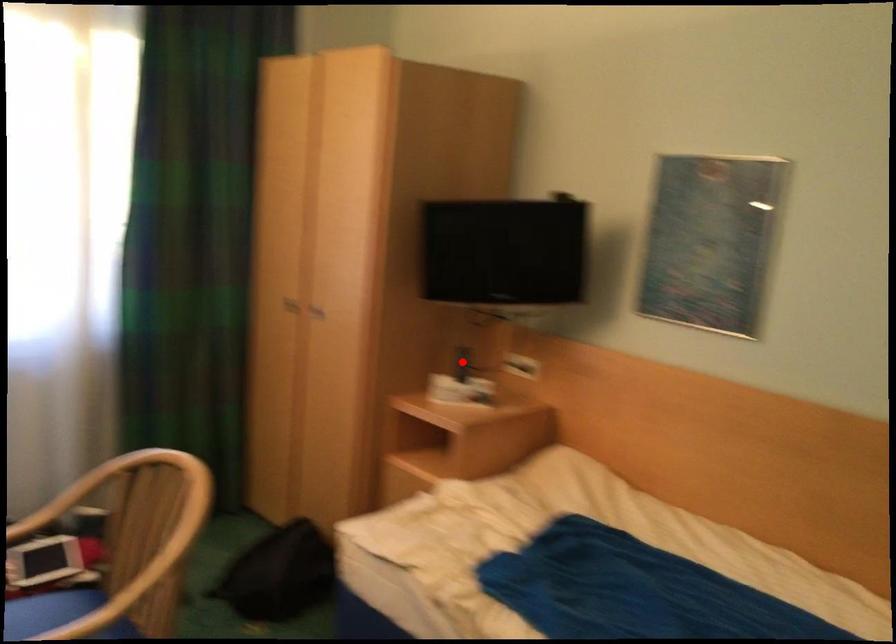
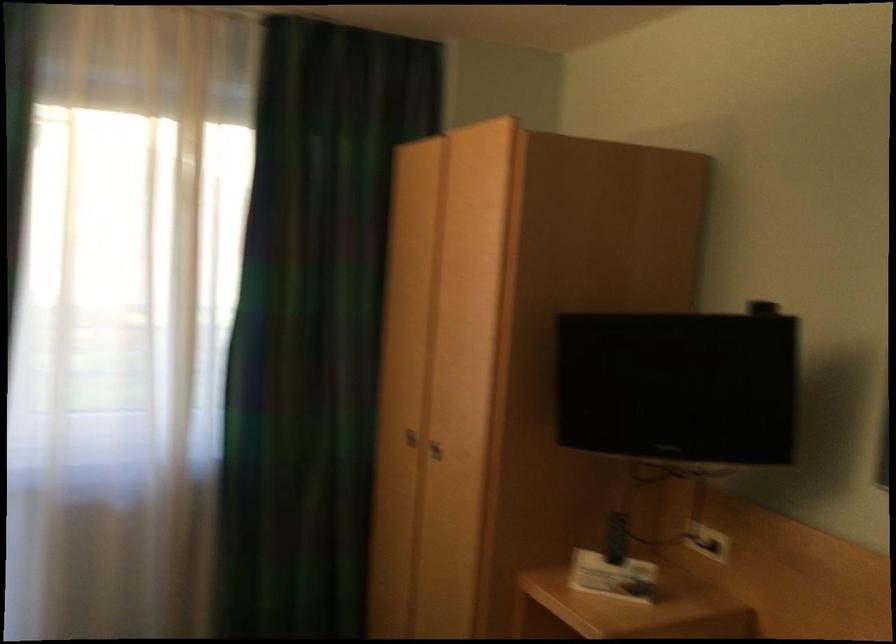
The point at the highlighted location is marked in the first image. Where is the corresponding point in the second image?

(616, 538)